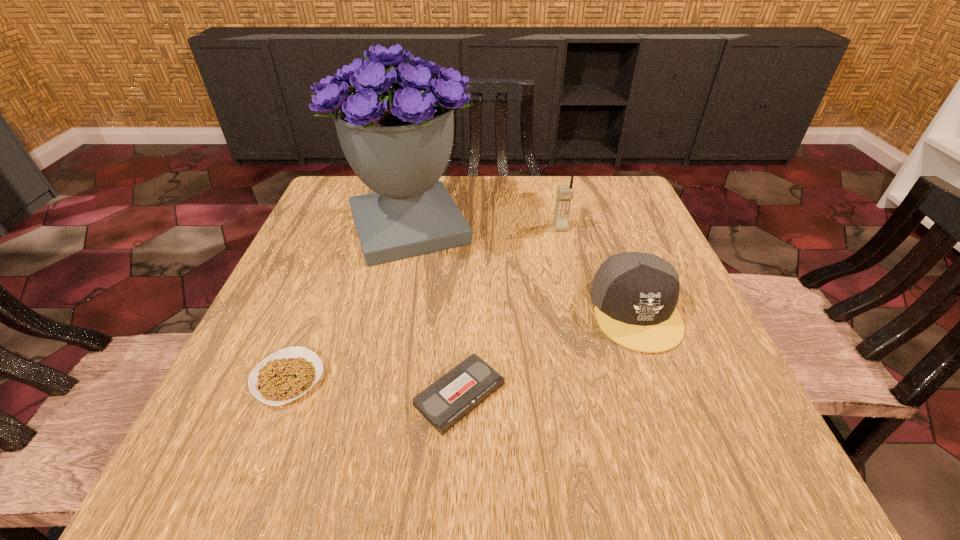
Identify the location of vacant space situated 0.110m on the right of the second shortest object. (391, 379).

Find the location of `vacant space located 0.080m on the right of the videotape`. vacant space located 0.080m on the right of the videotape is located at coordinates (556, 395).

At what (x,y) coordinates should I click in order to perform the action: click on bouquet that is at the far edge. Please return your answer as a coordinate pair (x, y). The width and height of the screenshot is (960, 540). Looking at the image, I should click on (397, 137).

The image size is (960, 540). What are the coordinates of `cellular telephone positioned at the far edge` in the screenshot? It's located at (564, 192).

This screenshot has height=540, width=960. I want to click on object that is at the near edge, so click(447, 401).

Locate an element on the screen. bouquet present at the left edge is located at coordinates (397, 137).

Locate an element on the screen. legume present at the left edge is located at coordinates (287, 374).

This screenshot has width=960, height=540. What are the coordinates of `object that is at the right edge` in the screenshot? It's located at (635, 294).

What are the coordinates of `object that is at the far left corner` in the screenshot? It's located at (397, 137).

You are a GUI agent. You are given a task and a screenshot of the screen. Output one action in this format:
    pyautogui.click(x=<x>, y=<y>)
    Task: Click on the vacant space at the near edge of the desktop
    
    Given the screenshot: What is the action you would take?
    pyautogui.click(x=491, y=465)